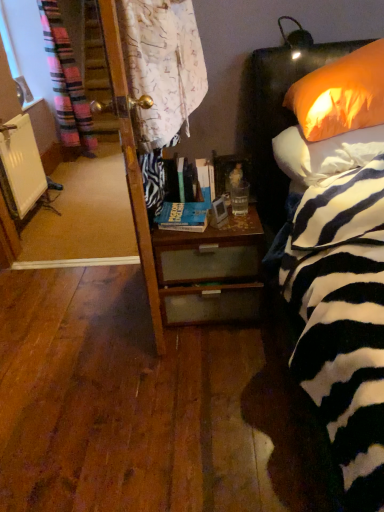
Question: Based on their positions, is orange fabric pillow at upper right, the first pillow ordered from the bottom, located to the left or right of woodendesk at center?

Choices:
 (A) left
 (B) right

Answer: (B)

Question: Do you think orange fabric pillow at upper right, the first pillow ordered from the bottom, is within woodendesk at center, or outside of it?

Choices:
 (A) outside
 (B) inside

Answer: (A)

Question: Based on their relative distances, which object is farther from the orange fabric pillow at upper right, the first pillow ordered from the bottom?

Choices:
 (A) woodendesk at center
 (B) translucent glass at bedside
 (C) hardcover book at center, which is the second book in bottom-to-top order
 (D) white matte radiator at left
 (E) orange fabric pillow at upper right, arranged as the 2th pillow when ordered from the bottom

Answer: (D)

Question: Which object is the farthest from the hardcover book at center, which is the second book in bottom-to-top order?

Choices:
 (A) translucent glass at bedside
 (B) orange fabric pillow at upper right, arranged as the 2th pillow when ordered from the bottom
 (C) woodendesk at center
 (D) orange fabric pillow at upper right, the first pillow ordered from the bottom
 (E) white matte radiator at left

Answer: (E)